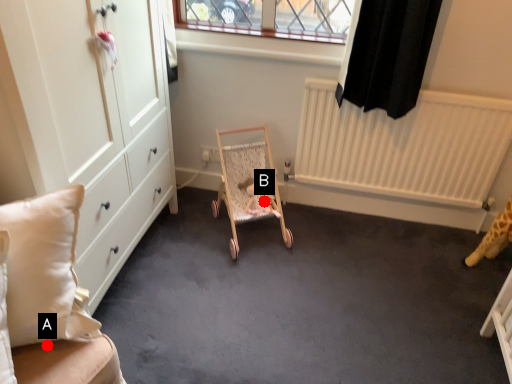
Question: Two points are circled on the image, labeled by A and B beside each circle. Which point is closer to the camera taking this photo?

Choices:
 (A) A is closer
 (B) B is closer

Answer: (A)